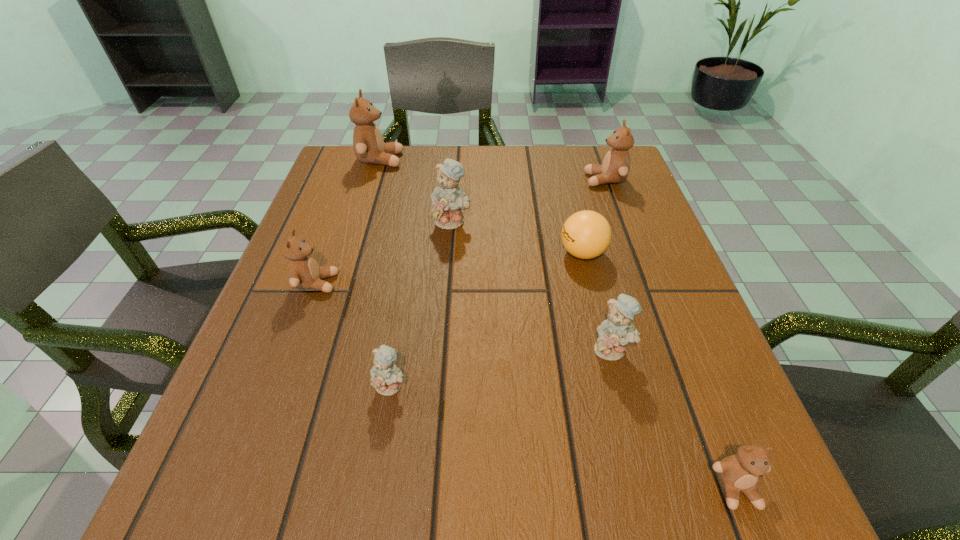
I want to click on the tallest teddy bear, so click(369, 147).

Where is `the biggest brown teddy bear`? the biggest brown teddy bear is located at coordinates (369, 147).

Identify the location of the third smallest brown teddy bear. The height and width of the screenshot is (540, 960). (615, 168).

I want to click on the biggest blue teddy bear, so click(448, 199).

Find the location of a particular element. The image size is (960, 540). the fifth object from right to left is located at coordinates (448, 199).

I want to click on the second nearest brown teddy bear, so [x=303, y=270].

Identify the location of the second smallest brown teddy bear. The height and width of the screenshot is (540, 960). (303, 270).

Where is `the second smallest blue teddy bear`? Image resolution: width=960 pixels, height=540 pixels. the second smallest blue teddy bear is located at coordinates (x=614, y=333).

Identify the location of the sixth farthest object. (614, 333).

Image resolution: width=960 pixels, height=540 pixels. Find the location of `ping-pong ball`. ping-pong ball is located at coordinates (586, 234).